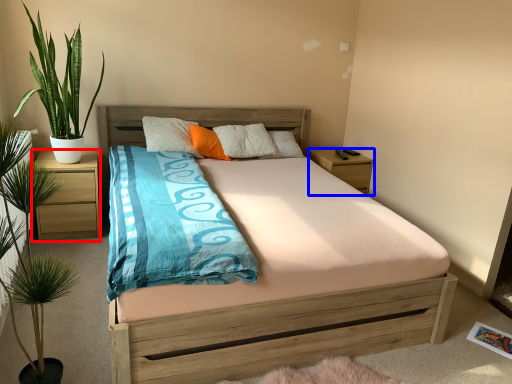
Question: Which object appears closest to the camera in this image, nightstand (highlighted by a red box) or nightstand (highlighted by a blue box)?

Choices:
 (A) nightstand
 (B) nightstand

Answer: (A)